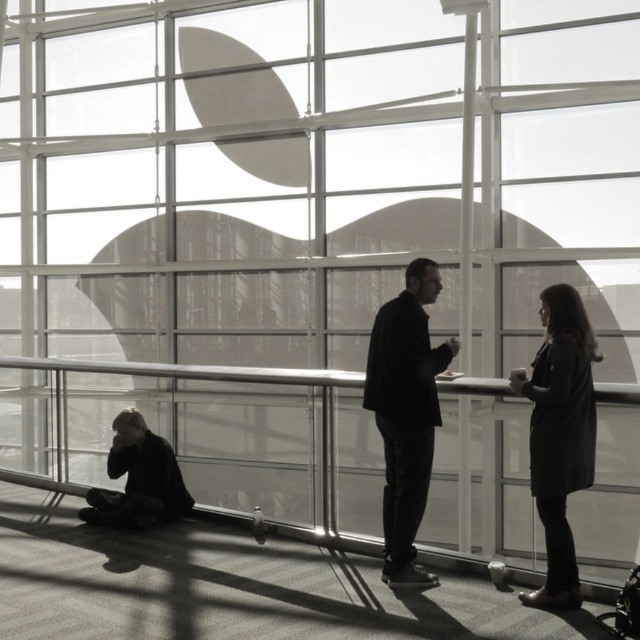
You are a photographer positioned at the entrance of the room. You need to capture a photo where both the black matte suit at center and the dark gray coat at lower left are clearly visible. Which object should you focus on first to ensure both are in sharp focus?

You should focus on the black matte suit at center first because it is closer to the viewer than the dark gray coat at lower left. By focusing on the closer object, the depth of field may naturally include the farther object in acceptable focus.

Consider the image. You are standing in the room and want to move from the point at coordinates point (x=22, y=358) to the point at coordinates point (x=144, y=499). Is the destination point in front of or behind you?

The point at coordinates point (x=144, y=499) is in front of you because the point at coordinates point (x=22, y=358) is behind it.